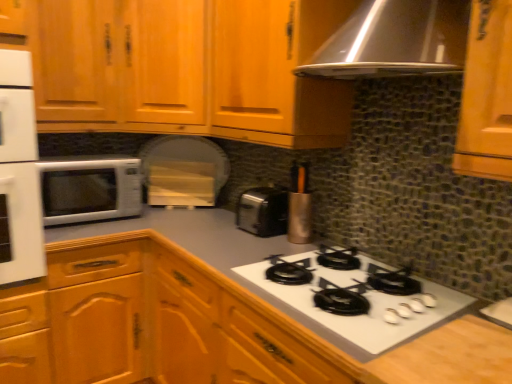
Identify the location of free spot behind white glossy sink at lower right. This screenshot has width=512, height=384. (462, 293).